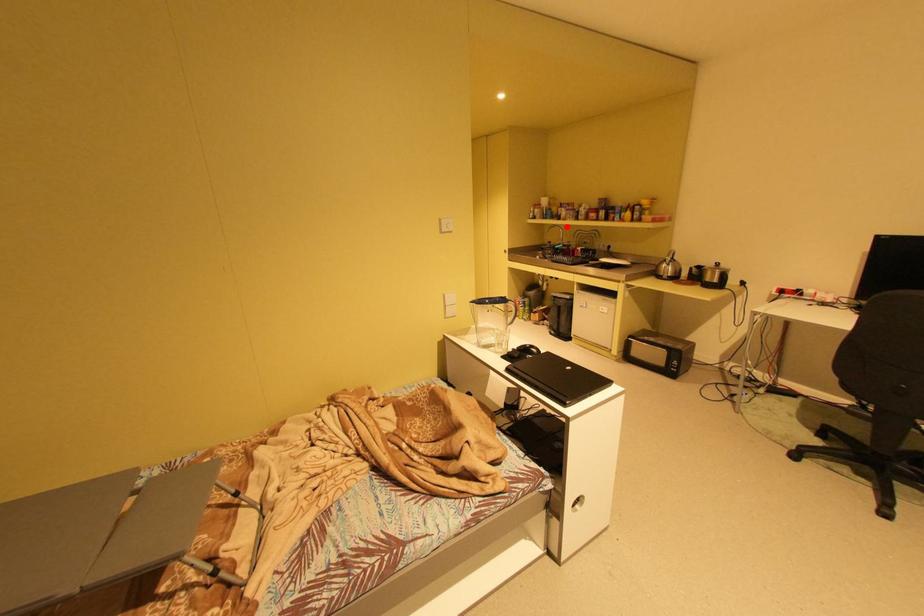
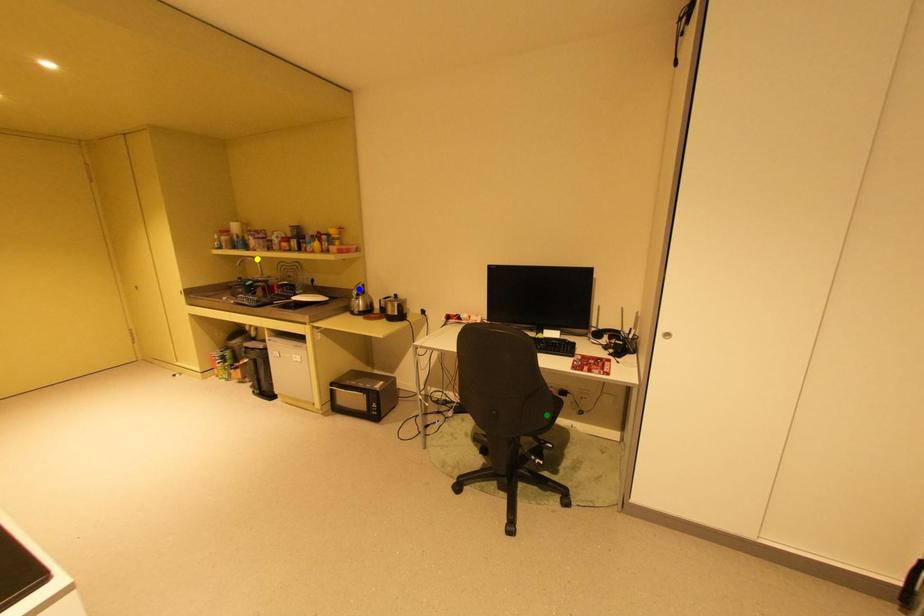
Question: I am providing you with two images of the same scene from different viewpoints. A red point is marked on the first image. You are given multiple points on the second image. Can you choose the point in image 2 that corresponds to the point in image 1?

Choices:
 (A) blue point
 (B) yellow point
 (C) green point

Answer: (B)